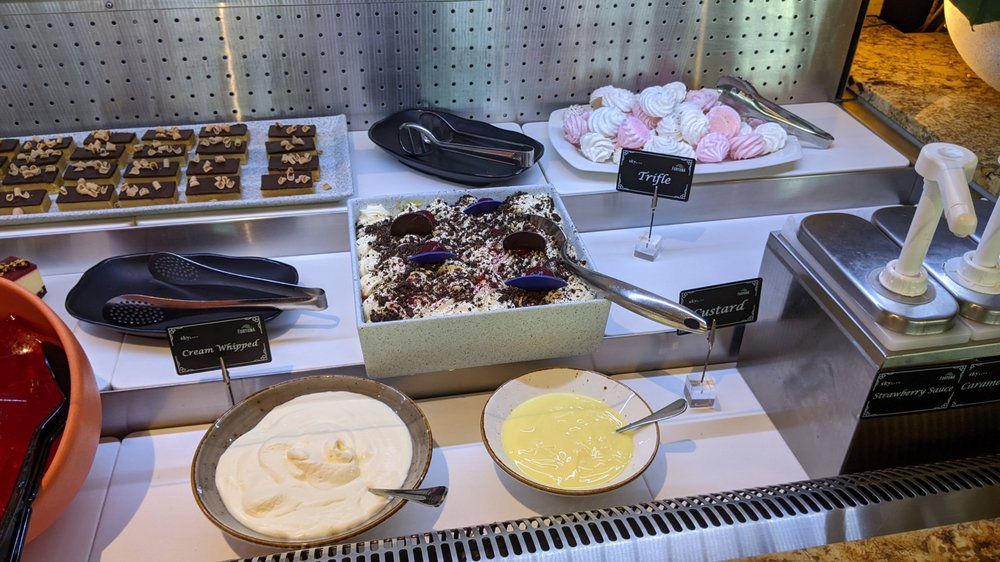
Where is `orange bowl`? orange bowl is located at coordinates (86, 424).